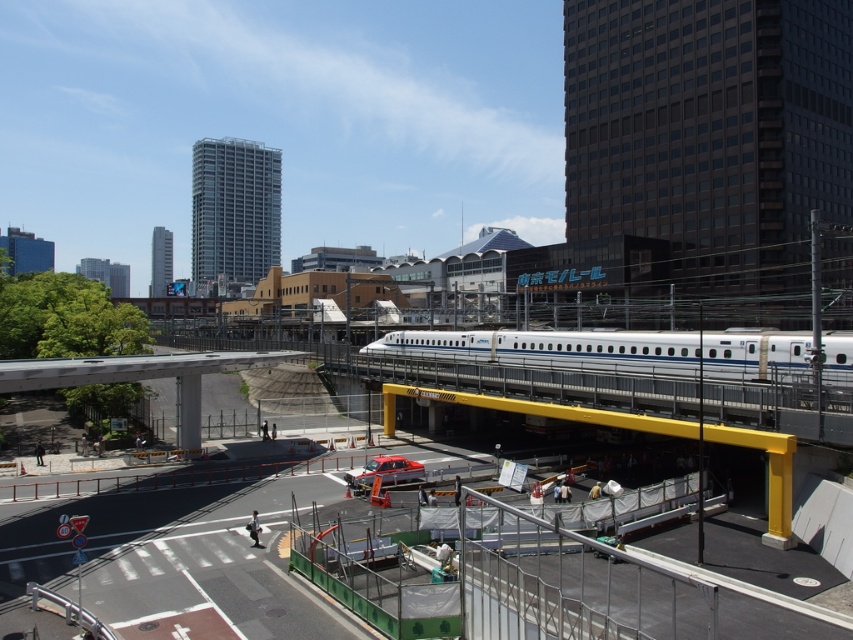
Is white glossy passenger train at center smaller than metallic silver car at center?

No.

You are a GUI agent. You are given a task and a screenshot of the screen. Output one action in this format:
    pyautogui.click(x=<x>, y=<y>)
    Task: Click on the white glossy passenger train at center
    Image resolution: width=853 pixels, height=640 pixels.
    Given the screenshot: What is the action you would take?
    pyautogui.click(x=554, y=349)